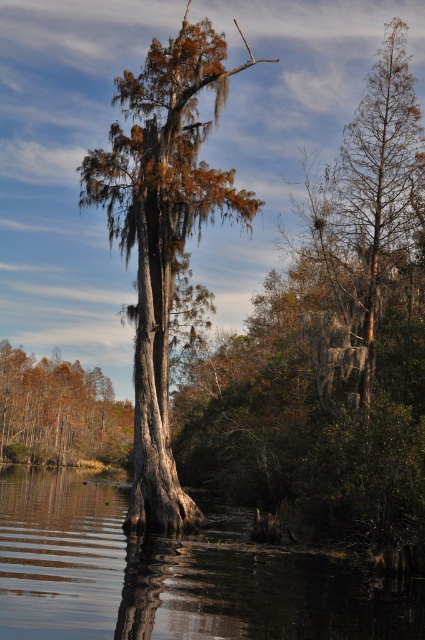
Between transparent water at center and brown matte tree at left, which one is positioned lower?

brown matte tree at left is below.

The width and height of the screenshot is (425, 640). I want to click on transparent water at center, so click(173, 573).

Which is more to the left, smooth gray bark cypress at center or brown matte tree at left?

brown matte tree at left is more to the left.

Between point (158, 132) and point (28, 358), which one is positioned in front?

Point (158, 132) is in front.

The image size is (425, 640). I want to click on smooth gray bark cypress at center, so click(163, 236).

Is transparent water at center below smooth gray bark cypress at center?

Yes, transparent water at center is below smooth gray bark cypress at center.

Between transparent water at center and smooth gray bark cypress at center, which one has more height?

smooth gray bark cypress at center

What do you see at coordinates (173, 573) in the screenshot? The image size is (425, 640). I see `transparent water at center` at bounding box center [173, 573].

Locate an element on the screen. Image resolution: width=425 pixels, height=640 pixels. transparent water at center is located at coordinates (173, 573).